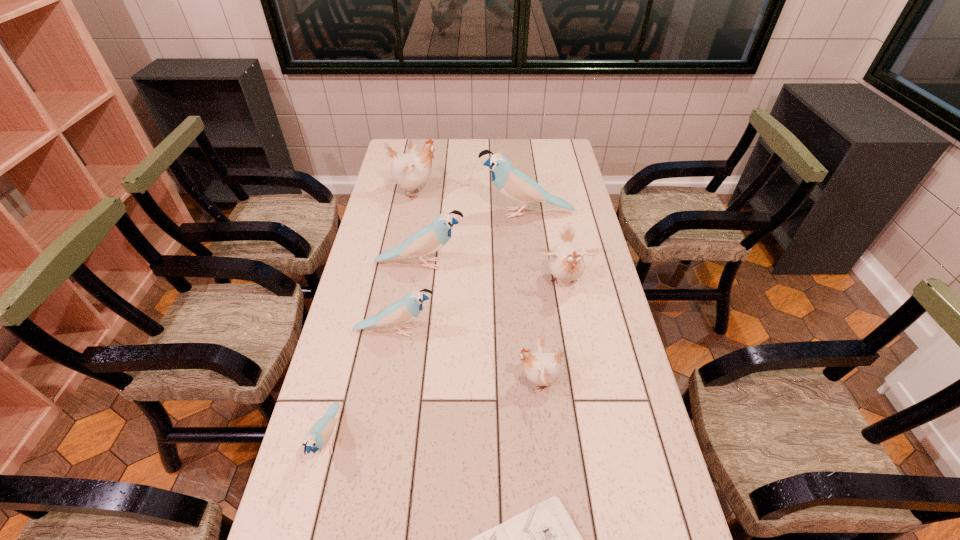
What are the coordinates of `free location located 0.080m at the face of the nearest blue bird` in the screenshot? It's located at (309, 517).

The image size is (960, 540). In order to click on free space at the far edge of the desktop in this screenshot , I will do `click(446, 154)`.

The height and width of the screenshot is (540, 960). I want to click on vacant space at the left edge, so click(x=375, y=198).

At what (x,y) coordinates should I click in order to perform the action: click on vacant space at the right edge. Please return your answer as a coordinate pair (x, y). Image resolution: width=960 pixels, height=540 pixels. Looking at the image, I should click on (576, 176).

Image resolution: width=960 pixels, height=540 pixels. I want to click on vacant space at the far right corner, so [569, 143].

Find the location of a particular element. Image resolution: width=960 pixels, height=540 pixels. free space between the smallest blue bird and the third nearest bird is located at coordinates (362, 385).

Locate an element on the screen. vacant area that lies between the second biggest white bird and the farthest blue bird is located at coordinates (545, 248).

Locate an element on the screen. Image resolution: width=960 pixels, height=540 pixels. free space between the leftmost white bird and the smallest blue bird is located at coordinates (372, 316).

I want to click on free space between the farthest blue bird and the third nearest bird, so click(461, 272).

Image resolution: width=960 pixels, height=540 pixels. Find the location of `unoccupied position between the second biggest white bird and the second nearest blue bird`. unoccupied position between the second biggest white bird and the second nearest blue bird is located at coordinates (480, 307).